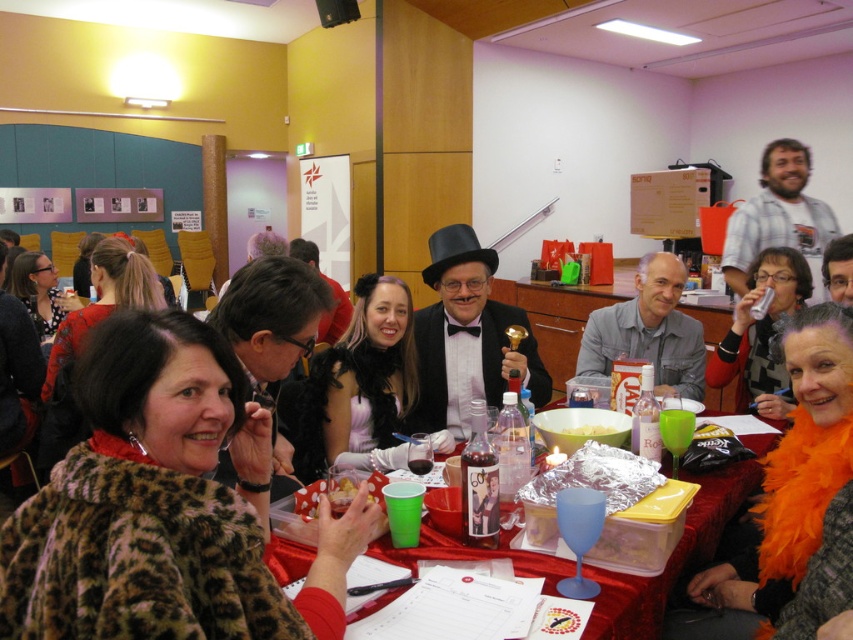
Question: Which of these objects is positioned farthest from the leopard print coat at lower left?

Choices:
 (A) orange feather boa at center
 (B) leopard print scarf at lower left
 (C) white creamy mashed potatoes at table center

Answer: (B)

Question: Is matte black coat at lower left bigger than smooth plastic bowl at center?

Choices:
 (A) yes
 (B) no

Answer: (A)

Question: Which is farther from the leopard print coat at lower left?

Choices:
 (A) smooth plastic bowl at center
 (B) leopard print scarf at lower left
 (C) matte black dress at center

Answer: (B)

Question: Is leopard print coat at lower left further to the viewer compared to matte black coat at lower left?

Choices:
 (A) no
 (B) yes

Answer: (A)

Question: Is translucent plastic cups at center closer to camera compared to matte black coat at lower left?

Choices:
 (A) no
 (B) yes

Answer: (B)

Question: Estimate the real-world distances between objects in this image. Which object is farther from the matte black coat at lower left?

Choices:
 (A) orange feather boa at center
 (B) white creamy mashed potatoes at table center

Answer: (A)